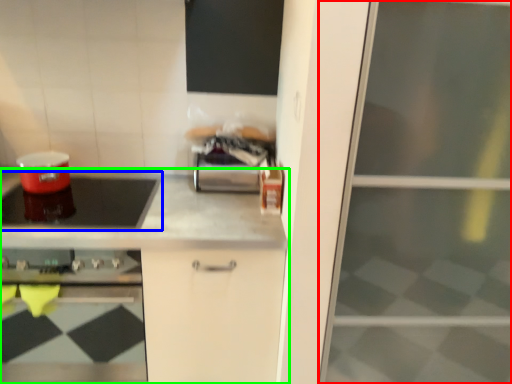
Question: Based on their relative distances, which object is nearer to screen door (highlighted by a red box)? Choose from kitchen appliance (highlighted by a blue box) and countertop (highlighted by a green box).

Choices:
 (A) kitchen appliance
 (B) countertop

Answer: (B)